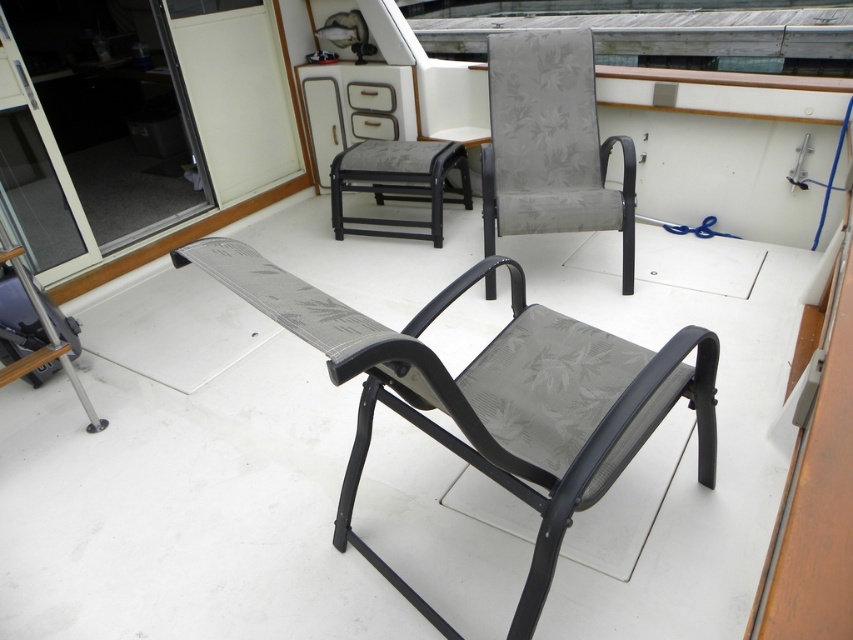
Question: In this image, where is textured grey fabric chair at center located relative to gray fabric stool at center?

Choices:
 (A) below
 (B) above

Answer: (A)

Question: In this image, where is gray fabric chair at upper center located relative to gray fabric stool at center?

Choices:
 (A) right
 (B) left

Answer: (A)

Question: Which of the following is the closest to the observer?

Choices:
 (A) transparent glass door at upper left
 (B) gray fabric chair at upper center

Answer: (B)

Question: Is textured grey fabric chair at center above gray fabric chair at upper center?

Choices:
 (A) no
 (B) yes

Answer: (A)

Question: Which object is positioned farthest from the transparent glass door at upper left?

Choices:
 (A) textured grey fabric chair at center
 (B) gray fabric stool at center

Answer: (A)

Question: Which of the following is the closest to the observer?

Choices:
 (A) (413, 236)
 (B) (498, 216)

Answer: (B)